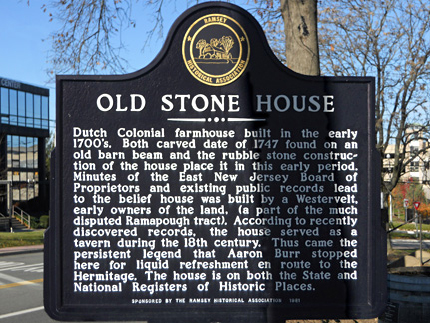
Locate an element on the screen. Image resolution: width=430 pixels, height=323 pixels. hand rail is located at coordinates (407, 222).